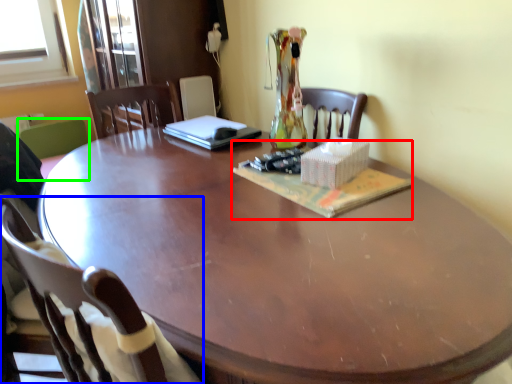
Question: Estimate the real-world distances between objects in this image. Which object is farther from magazine (highlighted by a red box), chair (highlighted by a blue box) or chair (highlighted by a green box)?

Choices:
 (A) chair
 (B) chair

Answer: (B)